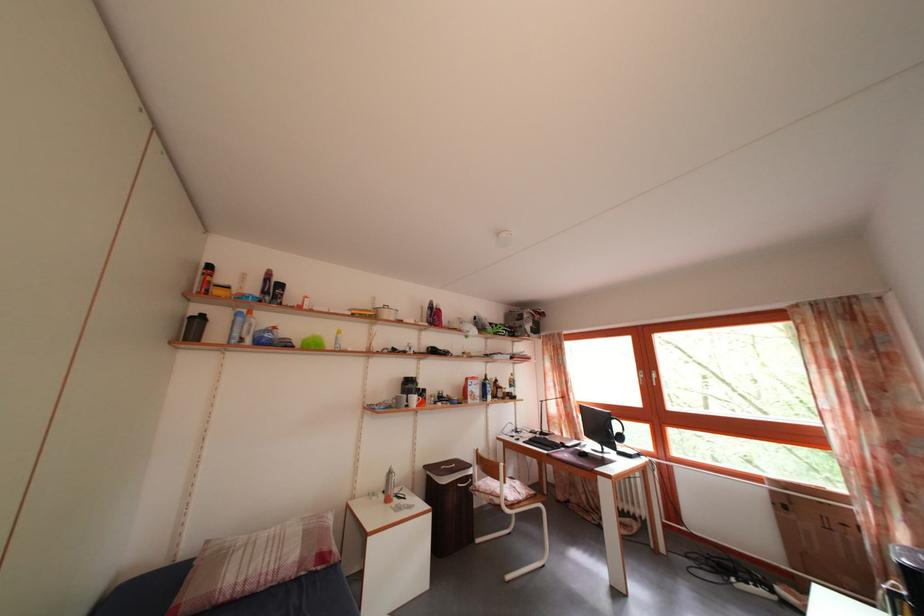
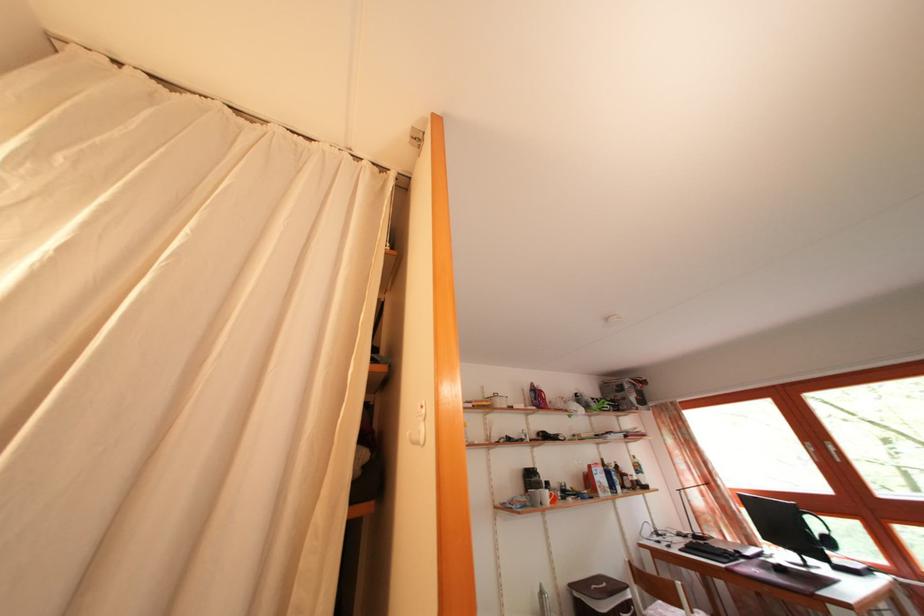
Where in the second image is the point corresponding to the point at 469,403 from the first image?

(593, 495)